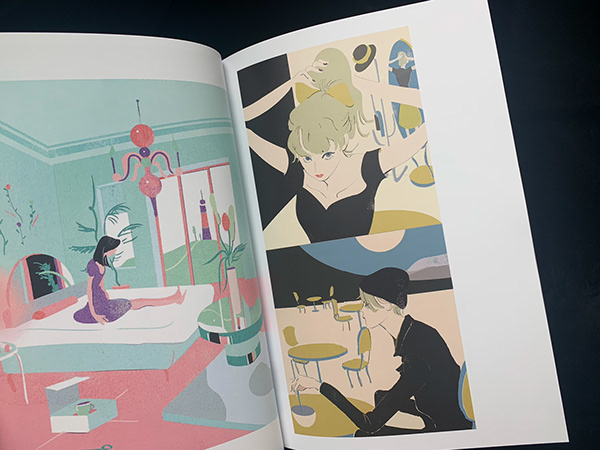
Locate an element on the screen. The image size is (600, 450). box is located at coordinates (59, 422).